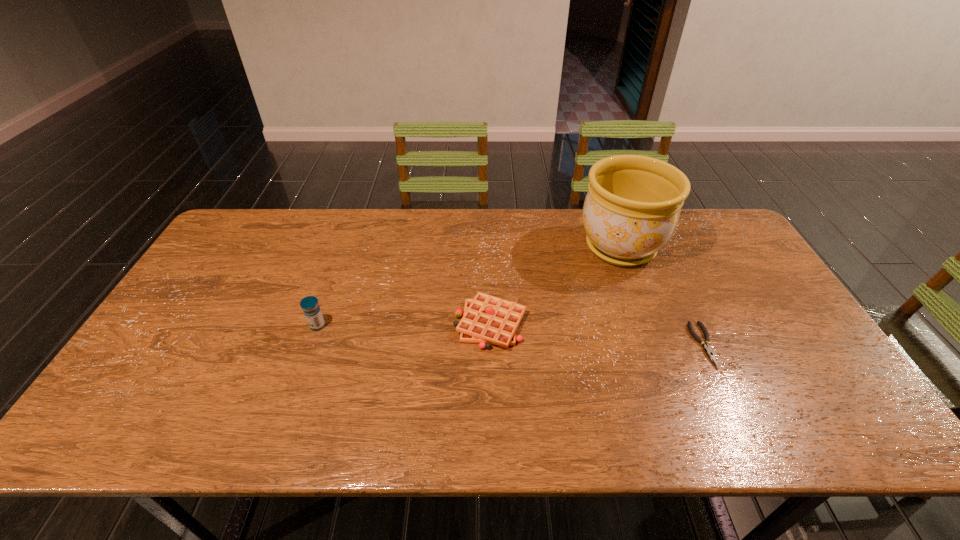
The width and height of the screenshot is (960, 540). What are the coordinates of `free space located on the left of the shortest object` in the screenshot? It's located at (549, 346).

This screenshot has width=960, height=540. In order to click on object that is at the far edge in this screenshot , I will do `click(631, 210)`.

Where is `vacant space at the far edge of the desktop`? This screenshot has height=540, width=960. vacant space at the far edge of the desktop is located at coordinates (539, 235).

Find the location of a particular element. vacant space at the near edge is located at coordinates (290, 443).

Locate an element on the screen. The image size is (960, 540). vacant area at the left edge is located at coordinates (207, 348).

Where is `vacant space at the right edge`? The image size is (960, 540). vacant space at the right edge is located at coordinates (725, 264).

Locate an element on the screen. blank area at the far right corner is located at coordinates (697, 228).

In the image, there is a desktop. Identify the location of free space at the near right corner. (796, 417).

Where is `free spot between the leftmost object and the waffle`? The height and width of the screenshot is (540, 960). free spot between the leftmost object and the waffle is located at coordinates (404, 325).

Locate an element on the screen. The image size is (960, 540). blank region between the shortest object and the tallest object is located at coordinates coord(662,296).